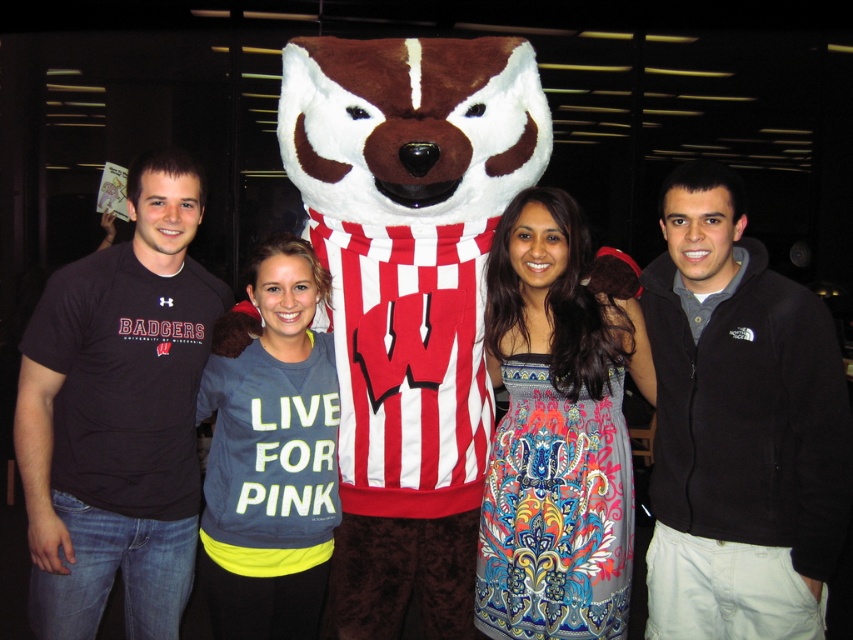
Is dark gray t-shirt at left shorter than dark blue jersey at center?

Incorrect, dark gray t-shirt at left's height does not fall short of dark blue jersey at center's.

Is dark gray t-shirt at left positioned behind dark blue jersey at center?

No, it is in front of dark blue jersey at center.

This screenshot has width=853, height=640. What do you see at coordinates (119, 416) in the screenshot? I see `dark gray t-shirt at left` at bounding box center [119, 416].

At what (x,y) coordinates should I click in order to perform the action: click on dark gray t-shirt at left. Please return your answer as a coordinate pair (x, y). Looking at the image, I should click on click(x=119, y=416).

Who is more distant from viewer, (x=485, y=212) or (x=671, y=348)?

The point (x=485, y=212) is behind.

Is fuzzy brown and white mascot at center smaller than dark gray fleece jacket at right?

No, fuzzy brown and white mascot at center is not smaller than dark gray fleece jacket at right.

Locate an element on the screen. This screenshot has height=640, width=853. fuzzy brown and white mascot at center is located at coordinates (408, 296).

Does dark gray fleece jacket at right come in front of dark gray t-shirt at left?

Yes, it is in front of dark gray t-shirt at left.

Based on the photo, is dark gray fleece jacket at right above dark gray t-shirt at left?

No, dark gray fleece jacket at right is not above dark gray t-shirt at left.

Between point (699, 580) and point (161, 624), which one is positioned behind?

The point (161, 624) is behind.

Locate an element on the screen. This screenshot has width=853, height=640. dark gray fleece jacket at right is located at coordinates (740, 428).